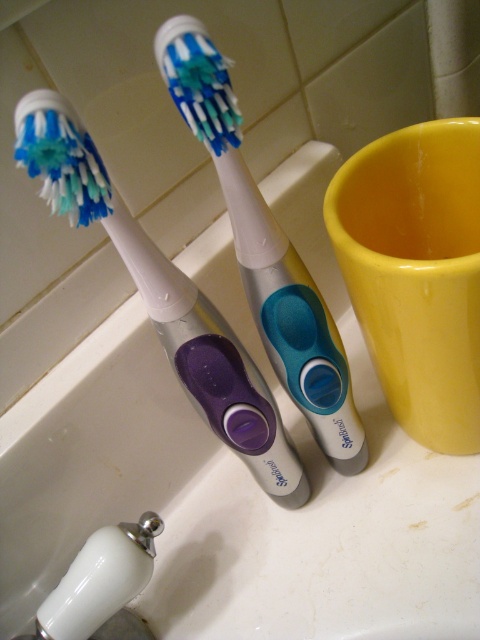
Question: Can you confirm if yellow glossy mug at right is positioned to the right of silver/plastic toothbrush at center?

Choices:
 (A) no
 (B) yes

Answer: (B)

Question: Is yellow glossy mug at right positioned behind purple plastic toothbrush at left?

Choices:
 (A) yes
 (B) no

Answer: (A)

Question: Based on their relative distances, which object is farther from the purple plastic toothbrush at left?

Choices:
 (A) yellow glossy mug at right
 (B) silver/plastic toothbrush at center

Answer: (A)

Question: Which of the following is the farthest from the observer?

Choices:
 (A) yellow glossy mug at right
 (B) silver/plastic toothbrush at center
 (C) purple plastic toothbrush at left

Answer: (A)

Question: Which of the following is the closest to the observer?

Choices:
 (A) (228, 93)
 (B) (72, 125)

Answer: (B)

Question: Is yellow glossy mug at right behind purple plastic toothbrush at left?

Choices:
 (A) yes
 (B) no

Answer: (A)